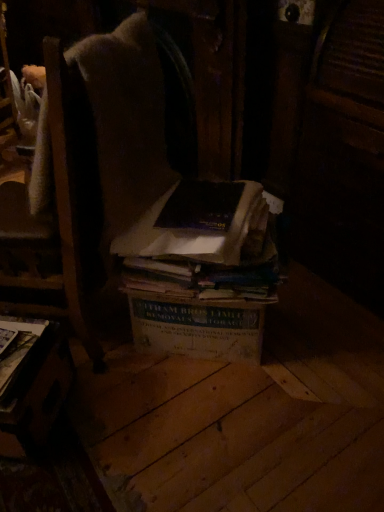
Question: Is dark brown paper book at center, acting as the second book starting from the left, shorter than wooden table at lower left?

Choices:
 (A) no
 (B) yes

Answer: (B)

Question: Can you confirm if dark brown paper book at center, the second book when ordered from right to left, is smaller than wooden table at lower left?

Choices:
 (A) no
 (B) yes

Answer: (A)

Question: Is dark brown paper book at center, the second book when ordered from right to left, closer to camera compared to wooden table at lower left?

Choices:
 (A) yes
 (B) no

Answer: (B)

Question: From a real-world perspective, is dark brown paper book at center, the second book when ordered from right to left, over wooden table at lower left?

Choices:
 (A) no
 (B) yes

Answer: (B)

Question: Does dark brown paper book at center, the second book when ordered from right to left, have a lesser width compared to wooden table at lower left?

Choices:
 (A) no
 (B) yes

Answer: (A)

Question: From the image's perspective, is brown cardboard box at center, placed as the third book when sorted from left to right, above or below hardcover book at lower left, the third book in the right-to-left sequence?

Choices:
 (A) below
 (B) above

Answer: (B)

Question: Considering the positions of brown cardboard box at center, the 1th book viewed from the right, and hardcover book at lower left, the third book in the right-to-left sequence, in the image, is brown cardboard box at center, the 1th book viewed from the right, bigger or smaller than hardcover book at lower left, the third book in the right-to-left sequence,?

Choices:
 (A) big
 (B) small

Answer: (A)

Question: Is brown cardboard box at center, placed as the third book when sorted from left to right, taller or shorter than hardcover book at lower left, the 1th book positioned from the left?

Choices:
 (A) tall
 (B) short

Answer: (A)

Question: In terms of width, does brown cardboard box at center, the 1th book viewed from the right, look wider or thinner when compared to hardcover book at lower left, the third book in the right-to-left sequence?

Choices:
 (A) thin
 (B) wide

Answer: (B)

Question: From a real-world perspective, relative to hardcover book at lower left, the 1th book positioned from the left, is wooden table at lower left vertically above or below?

Choices:
 (A) below
 (B) above

Answer: (A)

Question: From their relative heights in the image, would you say wooden table at lower left is taller or shorter than hardcover book at lower left, the third book in the right-to-left sequence?

Choices:
 (A) short
 (B) tall

Answer: (B)

Question: Based on their sizes in the image, would you say wooden table at lower left is bigger or smaller than hardcover book at lower left, the third book in the right-to-left sequence?

Choices:
 (A) small
 (B) big

Answer: (B)

Question: Considering the relative positions of wooden table at lower left and hardcover book at lower left, the third book in the right-to-left sequence, in the image provided, is wooden table at lower left to the left or to the right of hardcover book at lower left, the third book in the right-to-left sequence,?

Choices:
 (A) right
 (B) left

Answer: (A)

Question: Does point (38, 330) appear closer or farther from the camera than point (165, 198)?

Choices:
 (A) closer
 (B) farther

Answer: (A)

Question: From the image's perspective, is hardcover book at lower left, the 1th book positioned from the left, located above or below dark brown paper book at center, acting as the second book starting from the left?

Choices:
 (A) above
 (B) below

Answer: (B)